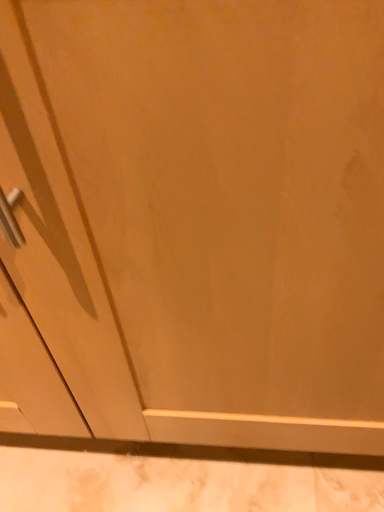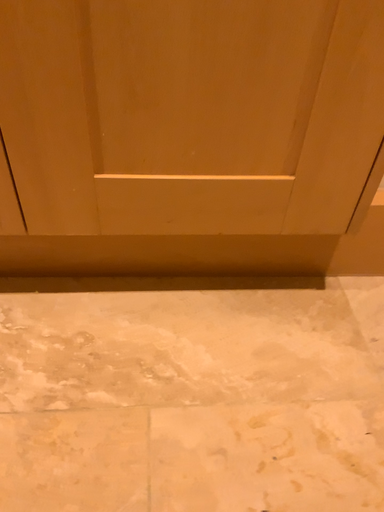
Question: How did the camera likely rotate when shooting the video?

Choices:
 (A) rotated right
 (B) rotated left

Answer: (A)